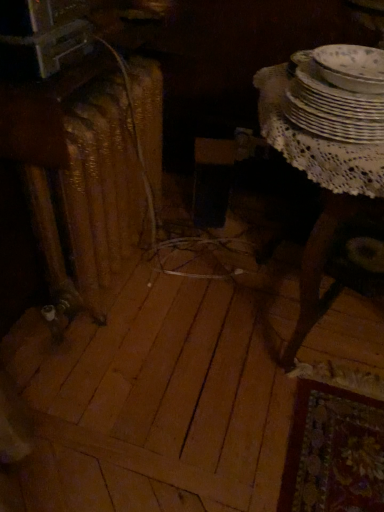
The width and height of the screenshot is (384, 512). In order to click on free point below white porcelain plates at upper right, the first tableware viewed from the top (from a real-world perspective) in this screenshot , I will do `click(355, 68)`.